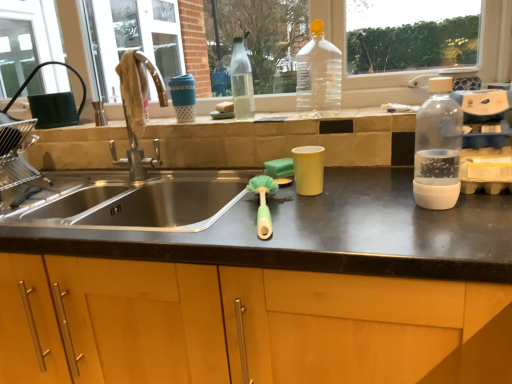
Where is `vacant position to the left of transparent plastic bottle at upper center, which appears as the second bottle when viewed from the right`? This screenshot has height=384, width=512. vacant position to the left of transparent plastic bottle at upper center, which appears as the second bottle when viewed from the right is located at coordinates click(274, 117).